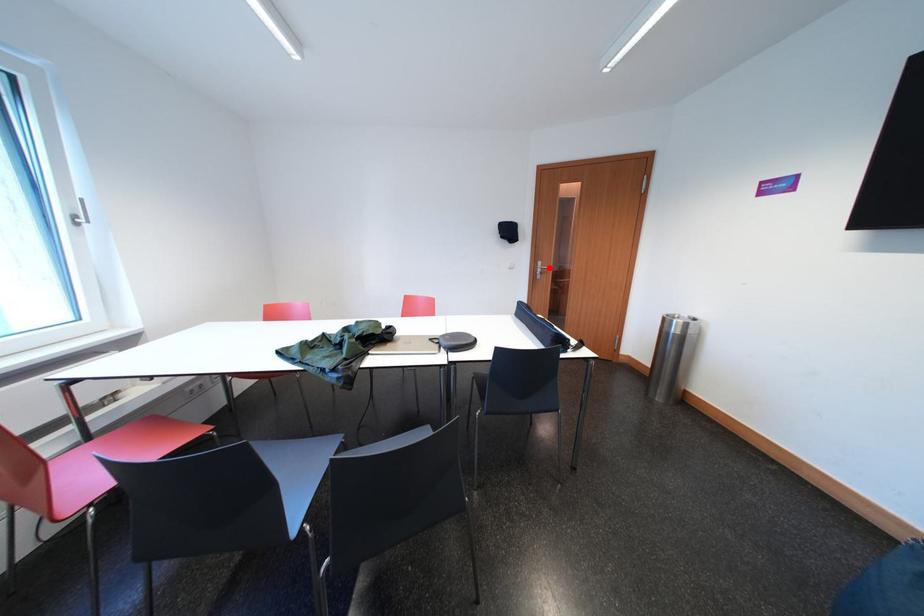
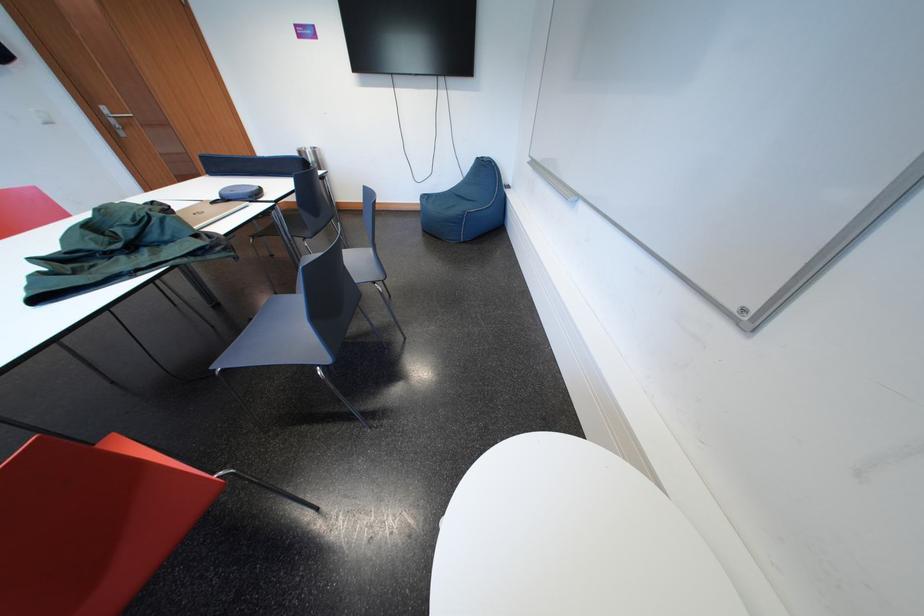
Question: I am providing you with two images of the same scene from different viewpoints. Image1 has a red point marked. In image2, the corresponding 3D location appears at what relative position? Reply with the corresponding letter.

Choices:
 (A) Closer
 (B) Farther

Answer: (B)